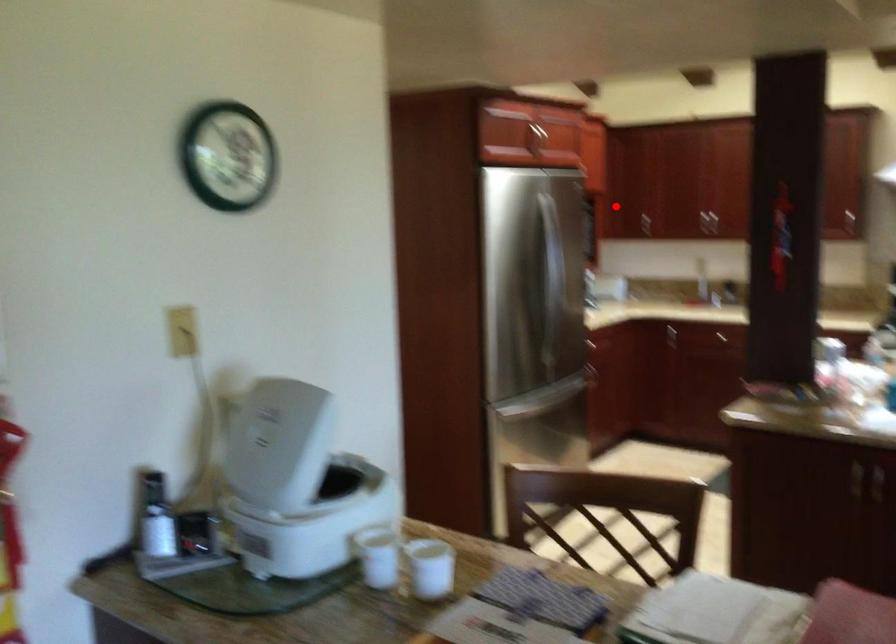
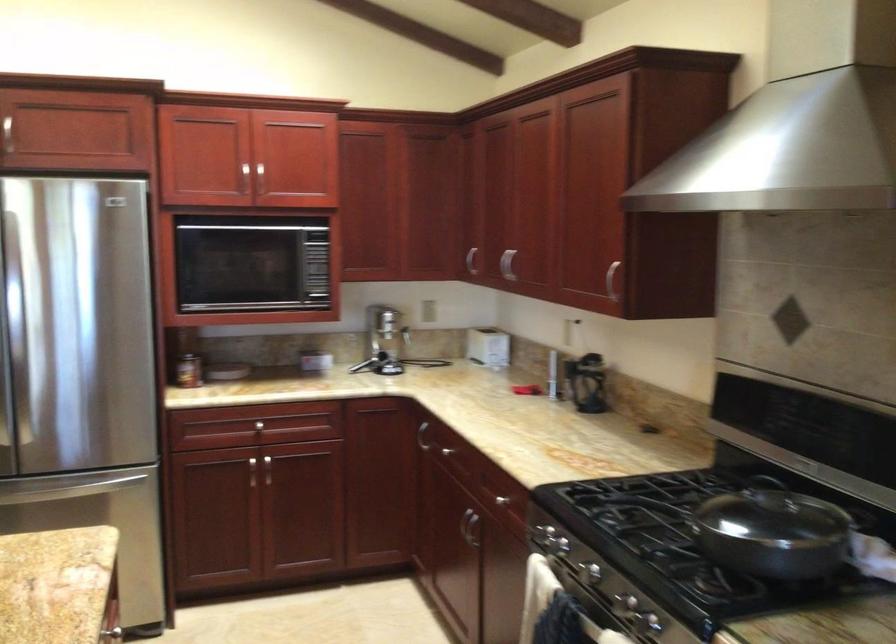
Question: I am providing you with two images of the same scene from different viewpoints. In image1, a red point is highlighted. Considering the same 3D point in image2, which of the following is correct?

Choices:
 (A) It is closer
 (B) It is farther

Answer: (A)